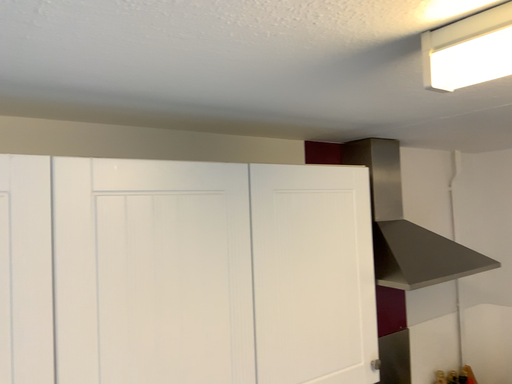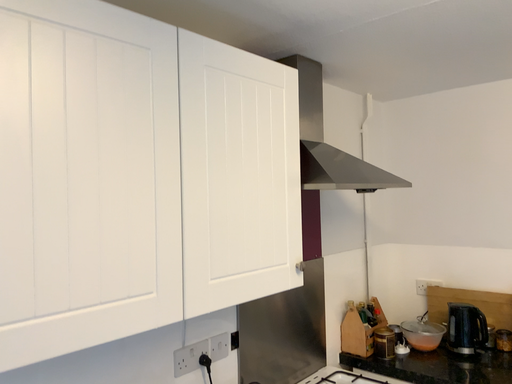
Question: How did the camera likely rotate when shooting the video?

Choices:
 (A) rotated right
 (B) rotated left

Answer: (A)